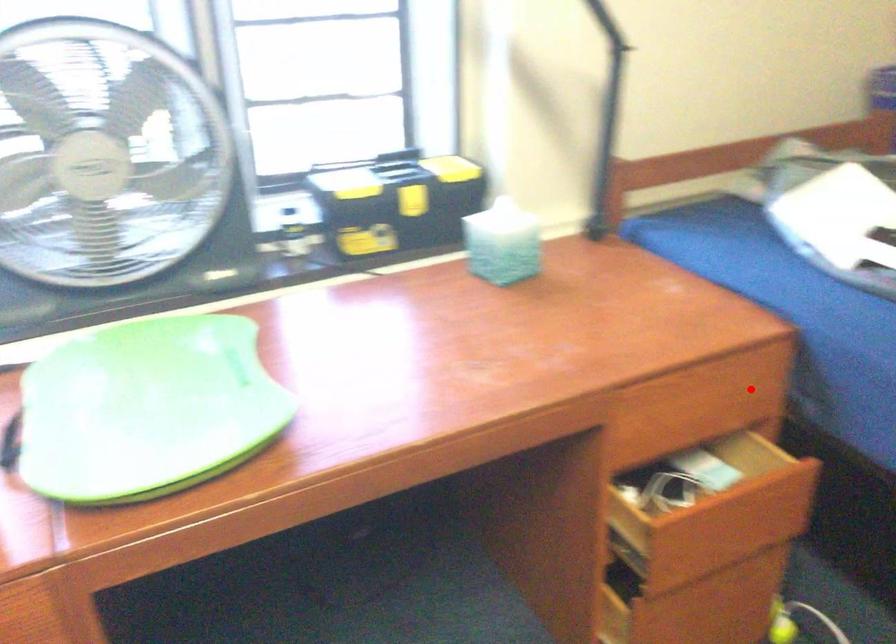
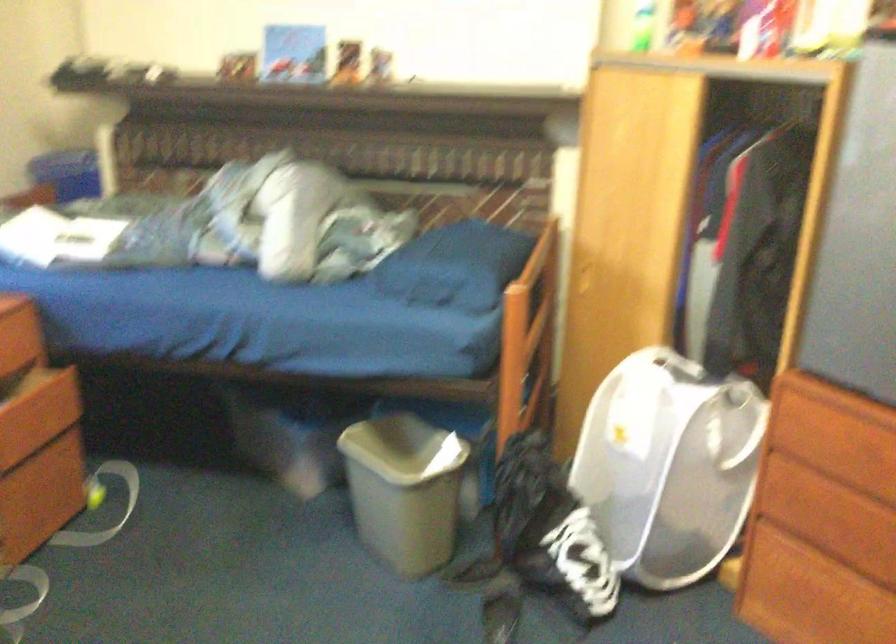
The point at the highlighted location is marked in the first image. Where is the corresponding point in the second image?

(19, 332)